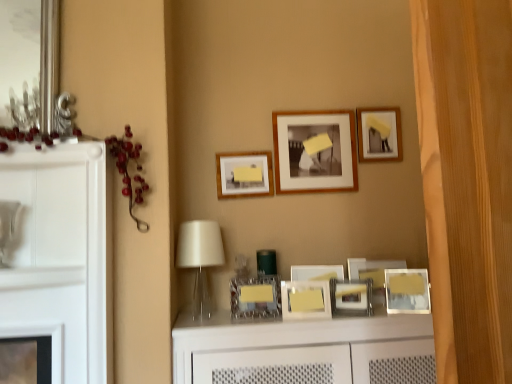
Question: Considering the positions of metallic silver picture frame at center, the 4th picture frame from the bottom, and metallic silver picture frame at center, placed as the 7th picture frame when sorted from top to bottom, in the image, is metallic silver picture frame at center, the 4th picture frame from the bottom, wider or thinner than metallic silver picture frame at center, placed as the 7th picture frame when sorted from top to bottom,?

Choices:
 (A) wide
 (B) thin

Answer: (A)

Question: Visually, is metallic silver picture frame at center, the 4th picture frame from the bottom, positioned to the left or to the right of metallic silver picture frame at center, placed as the 7th picture frame when sorted from top to bottom?

Choices:
 (A) left
 (B) right

Answer: (B)

Question: Estimate the real-world distances between objects in this image. Which object is closer to the metallic silver picture frame at center, the 3th picture frame when ordered from bottom to top?

Choices:
 (A) wooden photo frame at center, which is the second picture frame in top-to-bottom order
 (B) metallic silver picture frame at center, placed as the 7th picture frame when sorted from top to bottom
 (C) matte wooden picture frame at upper center, the 3th picture frame viewed from the top
 (D) metallic silver picture frame at lower right, the fifth picture frame from the bottom
 (E) translucent glass table lamp at center

Answer: (B)

Question: Which object is the farthest from the metallic silver picture frame at center, the 4th picture frame from the bottom?

Choices:
 (A) metallic silver picture frame at center, placed as the 7th picture frame when sorted from top to bottom
 (B) wooden photo frame at center, which ranks as the 7th picture frame in bottom-to-top order
 (C) wooden picture frame at upper right, placed as the 8th picture frame when sorted from bottom to top
 (D) translucent glass table lamp at center
 (E) metallic silver picture frame at center, acting as the sixth picture frame starting from the top

Answer: (D)